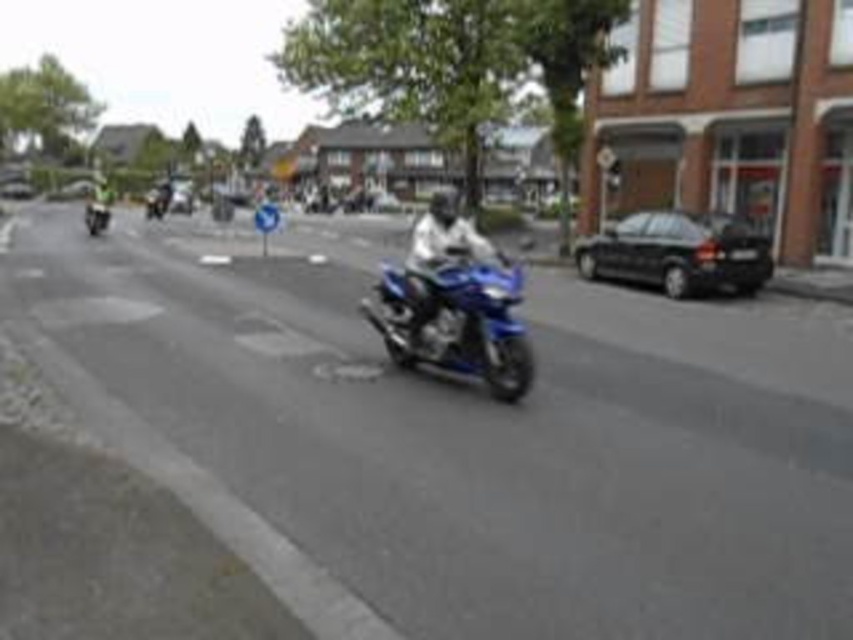
How much distance is there between white leather jacket at center and shiny metallic motorcycle at upper left?

The distance of white leather jacket at center from shiny metallic motorcycle at upper left is 783.26 feet.

Is white leather jacket at center above shiny metallic motorcycle at upper left?

Incorrect, white leather jacket at center is not positioned above shiny metallic motorcycle at upper left.

What do you see at coordinates (445, 230) in the screenshot? I see `white leather jacket at center` at bounding box center [445, 230].

The width and height of the screenshot is (853, 640). What are the coordinates of `white leather jacket at center` in the screenshot? It's located at (445, 230).

Measure the distance between point (163, 211) and camera.

The distance of point (163, 211) from camera is 2008.84 feet.

Does shiny metallic motorcycle at upper left have a larger size compared to shiny blue motorcycle at left?

Incorrect, shiny metallic motorcycle at upper left is not larger than shiny blue motorcycle at left.

Find the location of a particular element. shiny metallic motorcycle at upper left is located at coordinates (157, 200).

Where is `shiny metallic motorcycle at upper left`? The height and width of the screenshot is (640, 853). shiny metallic motorcycle at upper left is located at coordinates (157, 200).

Between shiny blue motorcycle at center and shiny metallic motorcycle at upper left, which one appears on the left side from the viewer's perspective?

shiny metallic motorcycle at upper left

Is shiny blue motorcycle at center smaller than shiny metallic motorcycle at upper left?

Correct, shiny blue motorcycle at center occupies less space than shiny metallic motorcycle at upper left.

At what (x,y) coordinates should I click in order to perform the action: click on shiny blue motorcycle at center. Please return your answer as a coordinate pair (x, y). Looking at the image, I should click on (456, 321).